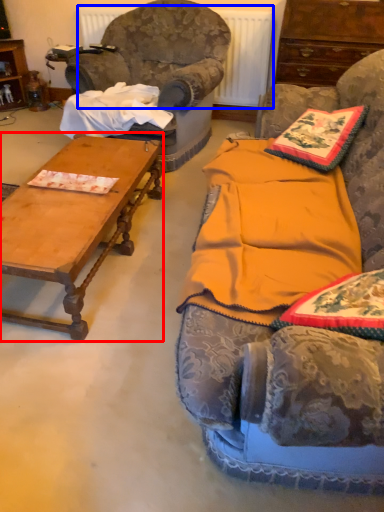
Question: Among these objects, which one is farthest to the camera, coffee table (highlighted by a red box) or radiator (highlighted by a blue box)?

Choices:
 (A) coffee table
 (B) radiator

Answer: (B)